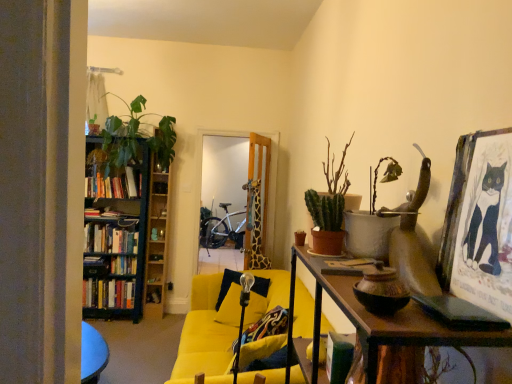
Question: Does hardcover books at left, the 3th book in the top-to-bottom sequence, appear on the right side of yellow fabric couch at center?

Choices:
 (A) yes
 (B) no

Answer: (B)

Question: Can you confirm if hardcover books at left, which appears as the first book when ordered from the bottom, is thinner than yellow fabric couch at center?

Choices:
 (A) no
 (B) yes

Answer: (B)

Question: Is hardcover books at left, which appears as the first book when ordered from the bottom, positioned with its back to yellow fabric couch at center?

Choices:
 (A) yes
 (B) no

Answer: (B)

Question: Can you confirm if hardcover books at left, the 3th book in the top-to-bottom sequence, is bigger than yellow fabric couch at center?

Choices:
 (A) yes
 (B) no

Answer: (B)

Question: Is hardcover books at left, which appears as the first book when ordered from the bottom, beside yellow fabric couch at center?

Choices:
 (A) no
 (B) yes

Answer: (A)

Question: From a real-world perspective, is hardcover books at left, which appears as the first book when ordered from the bottom, positioned above or below wooden bookshelf at left?

Choices:
 (A) below
 (B) above

Answer: (A)

Question: Choose the correct answer: Is hardcover books at left, which appears as the first book when ordered from the bottom, inside wooden bookshelf at left or outside it?

Choices:
 (A) inside
 (B) outside

Answer: (A)

Question: In the image, is hardcover books at left, the 3th book in the top-to-bottom sequence, positioned in front of or behind wooden bookshelf at left?

Choices:
 (A) behind
 (B) front

Answer: (A)

Question: Considering the positions of hardcover books at left, which appears as the first book when ordered from the bottom, and wooden bookshelf at left in the image, is hardcover books at left, which appears as the first book when ordered from the bottom, taller or shorter than wooden bookshelf at left?

Choices:
 (A) tall
 (B) short

Answer: (B)

Question: Considering the positions of wooden bookshelf at left and silver metallic bicycle at center in the image, is wooden bookshelf at left taller or shorter than silver metallic bicycle at center?

Choices:
 (A) short
 (B) tall

Answer: (B)

Question: In terms of width, does wooden bookshelf at left look wider or thinner when compared to silver metallic bicycle at center?

Choices:
 (A) thin
 (B) wide

Answer: (A)

Question: Is wooden bookshelf at left in front of or behind silver metallic bicycle at center in the image?

Choices:
 (A) front
 (B) behind

Answer: (A)

Question: Which is correct: wooden bookshelf at left is inside silver metallic bicycle at center, or outside of it?

Choices:
 (A) outside
 (B) inside

Answer: (A)

Question: Is wooden bookshelf at left bigger or smaller than hardcover books at left, which appears as the first book when ordered from the bottom?

Choices:
 (A) small
 (B) big

Answer: (B)

Question: Considering the positions of wooden bookshelf at left and hardcover books at left, the 3th book in the top-to-bottom sequence, in the image, is wooden bookshelf at left wider or thinner than hardcover books at left, the 3th book in the top-to-bottom sequence,?

Choices:
 (A) wide
 (B) thin

Answer: (A)